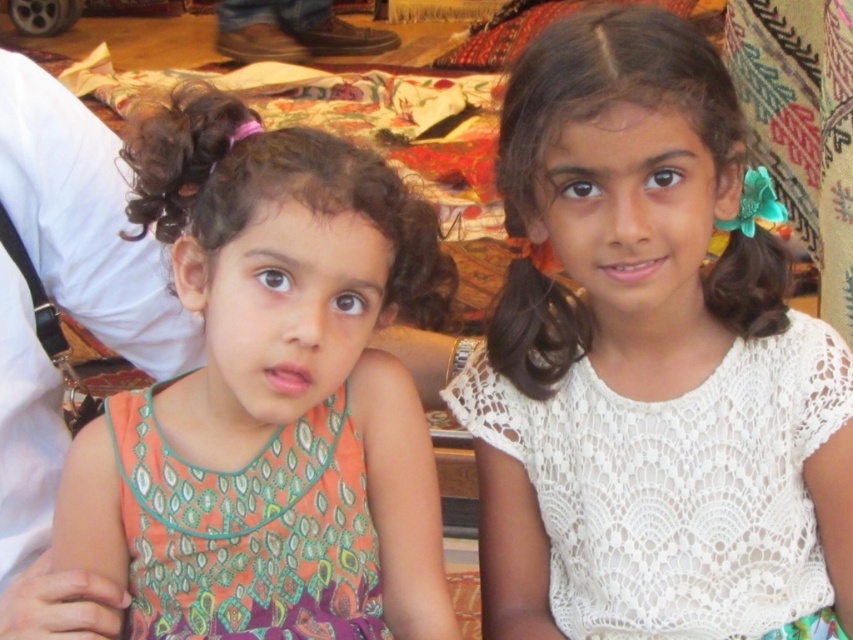
You are a photographer setting up a shoot in this scene. You need to place a prop between the orange printed dress at left and the white lace dress at center. Based on their positions, which dress should the prop be closer to?

The orange printed dress at left is positioned on the left side of the white lace dress at center, so the prop should be placed closer to the white lace dress at center to maintain symmetry between the two dresses.

You are a photographer setting up a shoot in this indoor scene. You need to position a light source so that it illuminates the orange printed dress at left and the white lace dress at center without casting shadows on the wall behind them. Considering their positions, where should you place the light source relative to the dresses?

The orange printed dress at left is above the white lace dress at center. To avoid casting shadows on the wall, the light source should be placed above both dresses, ensuring light falls directly downward, preventing shadows from extending towards the wall behind them.